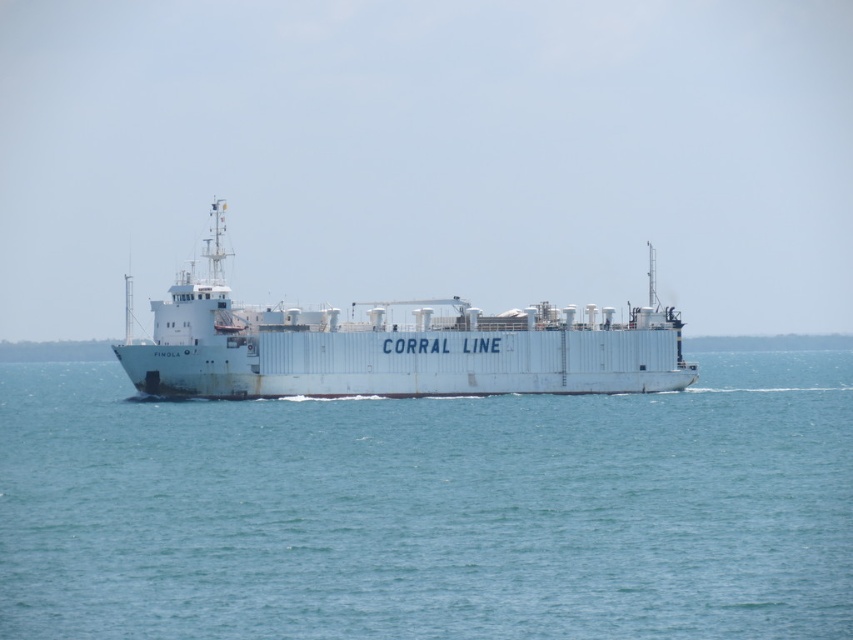
You are a sailor on the white matte ship at center. You want to check the water level below. Which object should you look below to see the blue water at center?

The blue water at center is located below the white matte ship at center, so the sailor should look below the white matte ship at center to see the blue water at center.

You are a sailor on the white matte ship at center. You need to navigate around a large floating obstacle that is as wide as the ship. Based on the scene, can you safely pass through the blue water at center with enough space?

The blue water at center might be wider than the white matte ship at center, so there is a possibility that the ship can safely navigate around the obstacle if the water width allows sufficient clearance. However, the exact dimensions are uncertain based on the provided information.